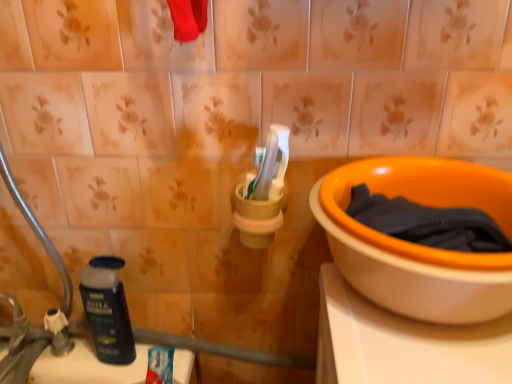
Question: From a real-world perspective, relative to silver metallic faucet at lower left, is dark blue plastic bottle at lower left vertically above or below?

Choices:
 (A) below
 (B) above

Answer: (B)

Question: Considering their positions, is dark blue plastic bottle at lower left located in front of or behind silver metallic faucet at lower left?

Choices:
 (A) behind
 (B) front

Answer: (A)

Question: Which object is positioned farthest from the dark blue fabric at right?

Choices:
 (A) dark blue plastic bottle at lower left
 (B) orange ceramic bowl at right
 (C) silver metallic faucet at lower left

Answer: (C)

Question: Which is nearer to the silver metallic faucet at lower left?

Choices:
 (A) orange ceramic bowl at right
 (B) dark blue fabric at right
 (C) dark blue plastic bottle at lower left

Answer: (C)